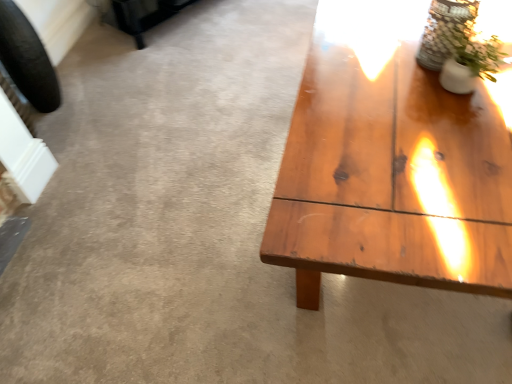
Question: Is clear glass vase at upper right oriented towards black rubber tire at left?

Choices:
 (A) yes
 (B) no

Answer: (A)

Question: From the image's perspective, is clear glass vase at upper right above black rubber tire at left?

Choices:
 (A) yes
 (B) no

Answer: (B)

Question: From a real-world perspective, is clear glass vase at upper right on black rubber tire at left?

Choices:
 (A) yes
 (B) no

Answer: (A)

Question: Does clear glass vase at upper right have a lesser width compared to black rubber tire at left?

Choices:
 (A) no
 (B) yes

Answer: (A)

Question: Is clear glass vase at upper right turned away from black rubber tire at left?

Choices:
 (A) yes
 (B) no

Answer: (B)

Question: Is clear glass vase at upper right shorter than black rubber tire at left?

Choices:
 (A) no
 (B) yes

Answer: (B)

Question: Is white ceramic vase at upper right taller than black rubber tire at left?

Choices:
 (A) yes
 (B) no

Answer: (B)

Question: Would you say white ceramic vase at upper right is outside black rubber tire at left?

Choices:
 (A) yes
 (B) no

Answer: (A)

Question: Considering the relative sizes of white ceramic vase at upper right and black rubber tire at left in the image provided, is white ceramic vase at upper right wider than black rubber tire at left?

Choices:
 (A) no
 (B) yes

Answer: (B)

Question: Is white ceramic vase at upper right bigger than black rubber tire at left?

Choices:
 (A) no
 (B) yes

Answer: (A)

Question: Does white ceramic vase at upper right lie behind black rubber tire at left?

Choices:
 (A) no
 (B) yes

Answer: (A)

Question: Can you confirm if white ceramic vase at upper right is thinner than black rubber tire at left?

Choices:
 (A) no
 (B) yes

Answer: (A)

Question: Can you confirm if white ceramic vase at upper right is taller than clear glass vase at upper right?

Choices:
 (A) no
 (B) yes

Answer: (A)